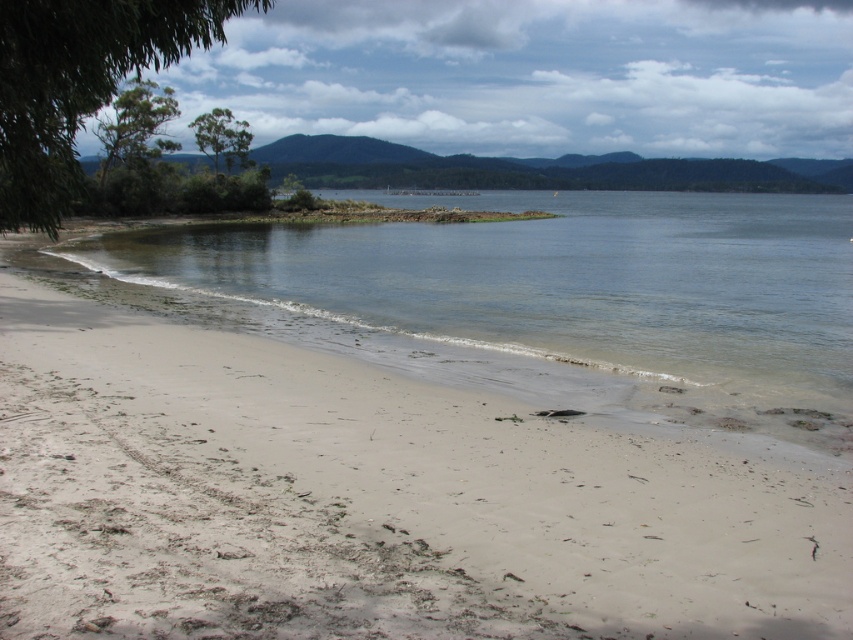
You are planning to build a small sandcastle on the white sandy beach at lower left and a water feature in the clear water at lower center. Considering the available space, which location would be more suitable for a larger structure?

The clear water at lower center occupies more space than the white sandy beach at lower left, so it would be more suitable for a larger water feature.

You are a swimmer looking to enter the water at the beach. You see the white sandy beach at lower left and the clear water at lower center. Which location should you choose to avoid stepping on debris?

You should choose the clear water at lower center to enter because the white sandy beach at lower left is positioned under it, meaning the clear water is the area free of debris.

You are standing on the white sandy beach at lower left and want to reach the clear water at lower center. Which direction should you walk to get there?

Since the white sandy beach at lower left is in front of the clear water at lower center, you should walk forward towards the clear water at lower center to reach it.